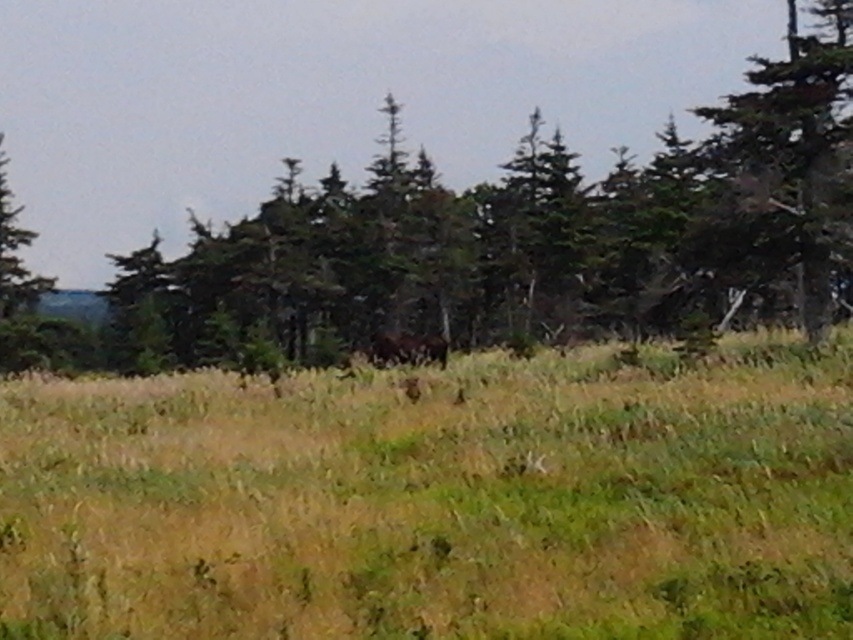
Question: Is green textured trees at upper center smaller than green textured tree at right?

Choices:
 (A) yes
 (B) no

Answer: (B)

Question: Which object is the farthest from the green textured tree at right?

Choices:
 (A) green grassy pasture at center
 (B) green textured trees at upper center

Answer: (B)

Question: Which of the following is the closest to the observer?

Choices:
 (A) (749, 129)
 (B) (483, 241)

Answer: (A)

Question: Which of the following is the farthest from the observer?

Choices:
 (A) green grassy pasture at center
 (B) green textured tree at right
 (C) green textured trees at upper center

Answer: (B)

Question: Is green textured trees at upper center thinner than green textured tree at right?

Choices:
 (A) yes
 (B) no

Answer: (B)

Question: Is green grassy pasture at center to the left of green textured trees at upper center from the viewer's perspective?

Choices:
 (A) yes
 (B) no

Answer: (A)